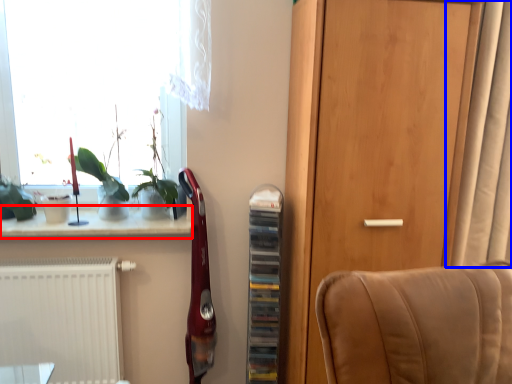
Question: Which object appears closest to the camera in this image, window sill (highlighted by a red box) or curtain (highlighted by a blue box)?

Choices:
 (A) window sill
 (B) curtain

Answer: (B)